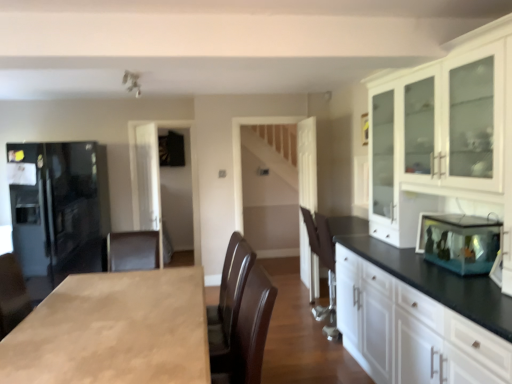
What is the approximate height of transparent glass fish tank at right?

It is 11.10 inches.

Identify the location of brown leather armchair at center. (324, 265).

At what (x,y) coordinates should I click in order to perform the action: click on black glossy refrigerator at left. Please return your answer as a coordinate pair (x, y). Looking at the image, I should click on (60, 209).

Does transparent glass cabinet at center have a lesser height compared to brown leather armchair at center?

No.

Between transparent glass cabinet at center and brown leather armchair at center, which one appears on the left side from the viewer's perspective?

From the viewer's perspective, transparent glass cabinet at center appears more on the left side.

What's the angular difference between transparent glass cabinet at center and brown leather armchair at center's facing directions?

The angular difference between transparent glass cabinet at center and brown leather armchair at center is 26.3 degrees.

Is transparent glass cabinet at center in front of black glossy refrigerator at left?

No, it is not.

In terms of size, does transparent glass cabinet at center appear bigger or smaller than black glossy refrigerator at left?

transparent glass cabinet at center is smaller than black glossy refrigerator at left.

Is the surface of transparent glass cabinet at center in direct contact with black glossy refrigerator at left?

No.

At what (x,y) coordinates should I click in order to perform the action: click on refrigerator below the transparent glass cabinet at center (from a real-world perspective). Please return your answer as a coordinate pair (x, y). The width and height of the screenshot is (512, 384). Looking at the image, I should click on (60, 209).

Does transparent glass fish tank at right have a greater width compared to light brown wood countertop at center?

No.

From the image's perspective, between transparent glass fish tank at right and light brown wood countertop at center, which one is located above?

From the image's view, transparent glass fish tank at right is above.

Between transparent glass fish tank at right and light brown wood countertop at center, which one is positioned in front?

Positioned in front is light brown wood countertop at center.

Would you say transparent glass fish tank at right is outside light brown wood countertop at center?

transparent glass fish tank at right is positioned outside light brown wood countertop at center.

Looking at their sizes, would you say black glossy refrigerator at left is wider or thinner than brown leather armchair at center?

Considering their sizes, black glossy refrigerator at left looks broader than brown leather armchair at center.

Which is further, (x=84, y=245) or (x=333, y=306)?

The point (x=84, y=245) is farther.

Are black glossy refrigerator at left and brown leather armchair at center far apart?

Absolutely, black glossy refrigerator at left is distant from brown leather armchair at center.

Would you say brown leather armchair at center is part of black glossy refrigerator at left's contents?

No, brown leather armchair at center is not a part of black glossy refrigerator at left.

Between black glossy refrigerator at left and transparent glass fish tank at right, which one appears on the right side from the viewer's perspective?

From the viewer's perspective, transparent glass fish tank at right appears more on the right side.

In the scene shown: Considering the relative positions of black glossy refrigerator at left and transparent glass fish tank at right in the image provided, is black glossy refrigerator at left in front of transparent glass fish tank at right?

No, the depth of black glossy refrigerator at left is greater than that of transparent glass fish tank at right.

Considering the relative sizes of black glossy refrigerator at left and transparent glass fish tank at right in the image provided, is black glossy refrigerator at left smaller than transparent glass fish tank at right?

Incorrect, black glossy refrigerator at left is not smaller in size than transparent glass fish tank at right.

Does point (66, 144) appear closer or farther from the camera than point (447, 262)?

Point (66, 144).

Considering the positions of objects transparent glass fish tank at right and brown leather armchair at center in the image provided, who is more to the right, transparent glass fish tank at right or brown leather armchair at center?

transparent glass fish tank at right is more to the right.

Is transparent glass fish tank at right oriented towards brown leather armchair at center?

No.

Looking at their sizes, would you say transparent glass fish tank at right is wider or thinner than brown leather armchair at center?

Considering their sizes, transparent glass fish tank at right looks slimmer than brown leather armchair at center.

Does point (141, 186) come farther from viewer compared to point (69, 298)?

Yes, it is.

Considering the relative sizes of transparent glass cabinet at center and light brown wood countertop at center in the image provided, is transparent glass cabinet at center wider than light brown wood countertop at center?

In fact, transparent glass cabinet at center might be narrower than light brown wood countertop at center.

Is transparent glass cabinet at center aimed at light brown wood countertop at center?

No, transparent glass cabinet at center is not oriented towards light brown wood countertop at center.

Does transparent glass cabinet at center touch light brown wood countertop at center?

No, transparent glass cabinet at center is not touching light brown wood countertop at center.

Where is `armchair below the transparent glass cabinet at center (from the image's perspective)`? The image size is (512, 384). armchair below the transparent glass cabinet at center (from the image's perspective) is located at coordinates (324, 265).

At what (x,y) coordinates should I click in order to perform the action: click on glass door located above the black glossy refrigerator at left (from the image's perspective). Please return your answer as a coordinate pair (x, y). Looking at the image, I should click on (148, 182).

Estimate the real-world distances between objects in this image. Which object is closer to brown leather armchair at center, transparent glass cabinet at center or transparent glass fish tank at right?

transparent glass fish tank at right lies closer to brown leather armchair at center than the other object.

Based on their spatial positions, is light brown wood countertop at center or brown leather armchair at center further from transparent glass fish tank at right?

light brown wood countertop at center lies further to transparent glass fish tank at right than the other object.

In the scene shown: When comparing their distances from black glossy refrigerator at left, does transparent glass cabinet at center or light brown wood countertop at center seem closer?

transparent glass cabinet at center is positioned closer to the anchor black glossy refrigerator at left.

Which object lies nearer to the anchor point brown leather armchair at center, light brown wood countertop at center or transparent glass fish tank at right?

Among the two, transparent glass fish tank at right is located nearer to brown leather armchair at center.

In the scene shown: When comparing their distances from transparent glass cabinet at center, does black glossy refrigerator at left or transparent glass fish tank at right seem closer?

black glossy refrigerator at left is closer to transparent glass cabinet at center.

Looking at the image, which one is located closer to transparent glass cabinet at center, brown leather armchair at center or transparent glass fish tank at right?

Based on the image, brown leather armchair at center appears to be nearer to transparent glass cabinet at center.

Looking at the image, which one is located closer to transparent glass cabinet at center, light brown wood countertop at center or brown leather armchair at center?

brown leather armchair at center is positioned closer to the anchor transparent glass cabinet at center.

When comparing their distances from light brown wood countertop at center, does black glossy refrigerator at left or brown leather armchair at center seem further?

black glossy refrigerator at left.

Locate an element on the screen. The width and height of the screenshot is (512, 384). armchair between transparent glass cabinet at center and transparent glass fish tank at right from left to right is located at coordinates (324, 265).

I want to click on armchair located between light brown wood countertop at center and transparent glass cabinet at center in the depth direction, so pyautogui.click(x=324, y=265).

Locate an element on the screen. The width and height of the screenshot is (512, 384). armchair located between black glossy refrigerator at left and transparent glass fish tank at right in the left-right direction is located at coordinates (324, 265).

Find the location of a particular element. The image size is (512, 384). glass door between black glossy refrigerator at left and transparent glass fish tank at right is located at coordinates (148, 182).